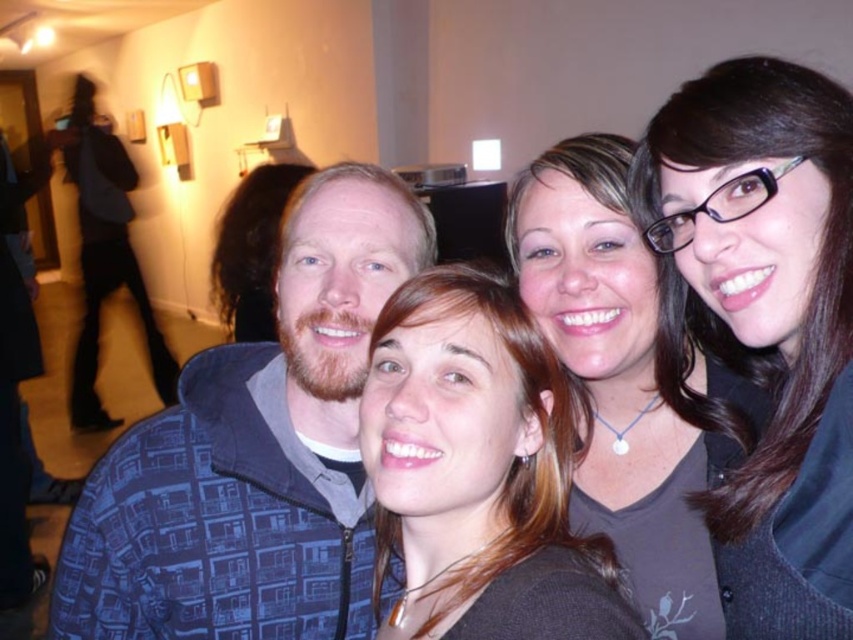
Question: Is blue printed jacket at center wider than matte gray sweater at upper right?

Choices:
 (A) yes
 (B) no

Answer: (A)

Question: Does smooth brown hair at center have a lesser width compared to matte gray sweater at upper right?

Choices:
 (A) no
 (B) yes

Answer: (B)

Question: Which point is farther from the camera taking this photo?

Choices:
 (A) (260, 500)
 (B) (668, 419)

Answer: (B)

Question: Which object appears closest to the camera in this image?

Choices:
 (A) black glossy hair at upper right
 (B) blue printed jacket at center

Answer: (A)

Question: Which object is positioned closest to the black glossy hair at upper right?

Choices:
 (A) blue patterned jacket at left
 (B) smooth brown hair at center

Answer: (B)

Question: Is blue printed jacket at center behind matte gray sweater at upper right?

Choices:
 (A) no
 (B) yes

Answer: (B)